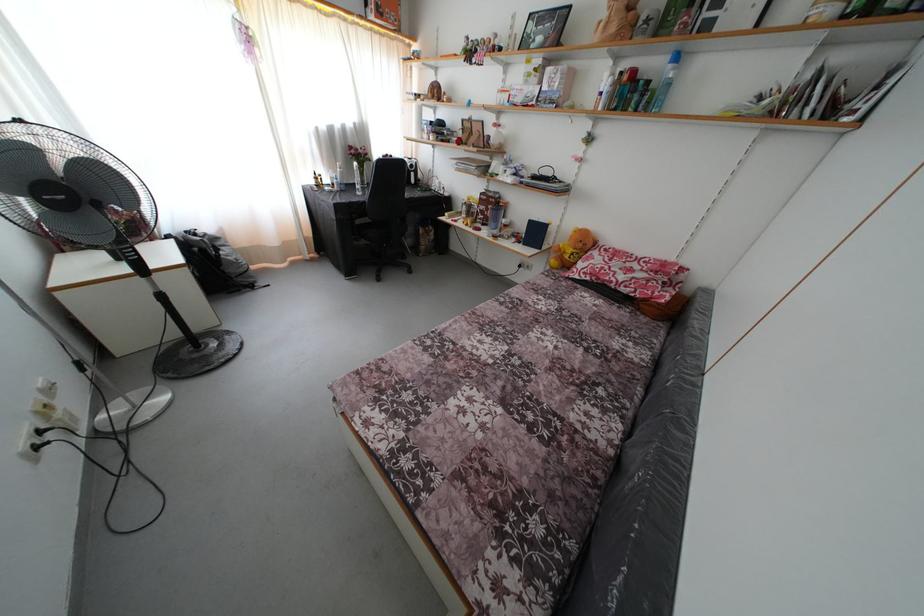
Locate an element on the screen. The width and height of the screenshot is (924, 616). blue drinking cup is located at coordinates (494, 219).